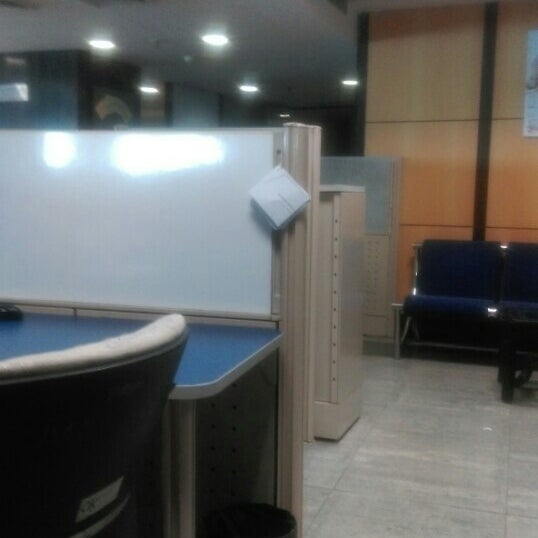
This screenshot has width=538, height=538. In order to click on overhead lights in this screenshot , I will do `click(346, 81)`, `click(104, 46)`, `click(214, 42)`, `click(145, 91)`, `click(247, 91)`.